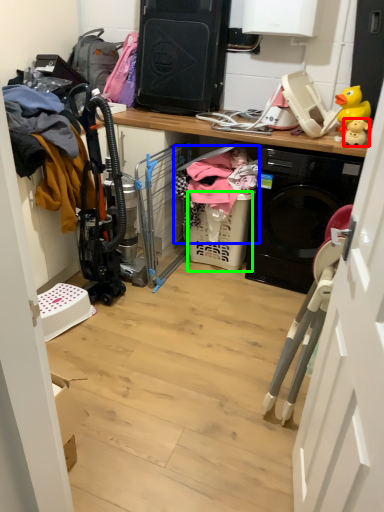
Question: Considering the real-world distances, which object is farthest from toy (highlighted by a red box)? clothing (highlighted by a blue box) or basket (highlighted by a green box)?

Choices:
 (A) clothing
 (B) basket

Answer: (B)